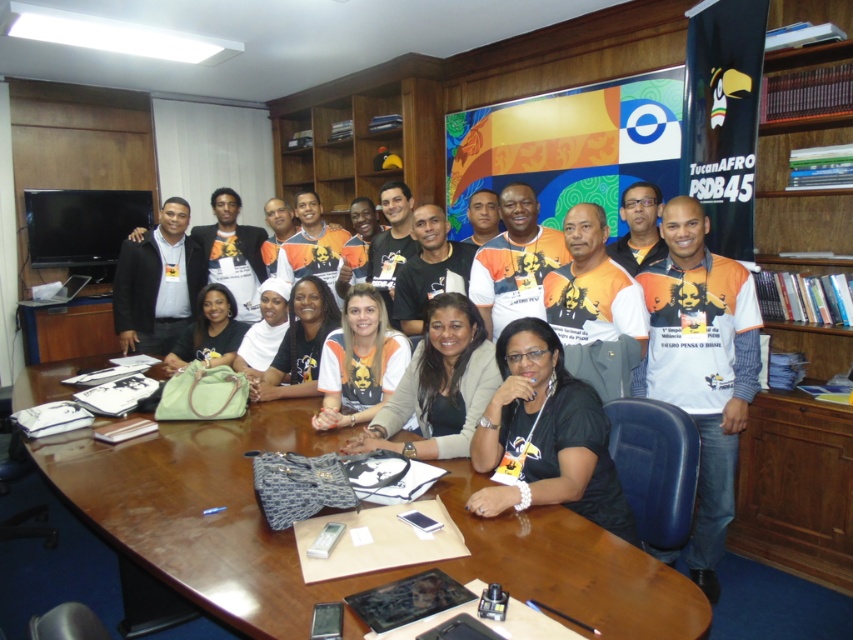
You are standing in the meeting room and need to place a new item on the wooden table at center. According to the room layout, where exactly should you place it?

The wooden table at center is located at point (293, 540), so you should place the new item there.

What object is located at the coordinate point [293,538] in the scene?

The wooden table at center is located at the coordinate point [293,538].